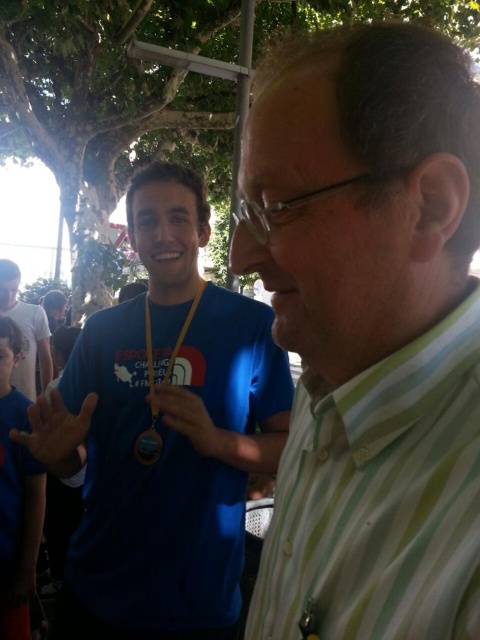
Question: Which point appears closest to the camera in this image?

Choices:
 (A) (187, 422)
 (B) (57, 468)

Answer: (A)

Question: Does blue fabric shirt at center appear over smooth skin hand at center?

Choices:
 (A) no
 (B) yes

Answer: (B)

Question: Which object appears farthest from the camera in this image?

Choices:
 (A) smooth skin hand at center
 (B) metallic gold medal at center
 (C) white cotton shirt at upper left
 (D) green striped shirt at center

Answer: (C)

Question: Which of the following is the closest to the observer?

Choices:
 (A) smooth skin hand at center
 (B) green striped shirt at center
 (C) matte blue lanyard at center
 (D) metallic gold medal at center

Answer: (B)

Question: Is yellow fabric lanyard at center smaller than metallic gold medal at center?

Choices:
 (A) yes
 (B) no

Answer: (B)

Question: Is green striped shirt at center bigger than yellow fabric lanyard at center?

Choices:
 (A) no
 (B) yes

Answer: (B)